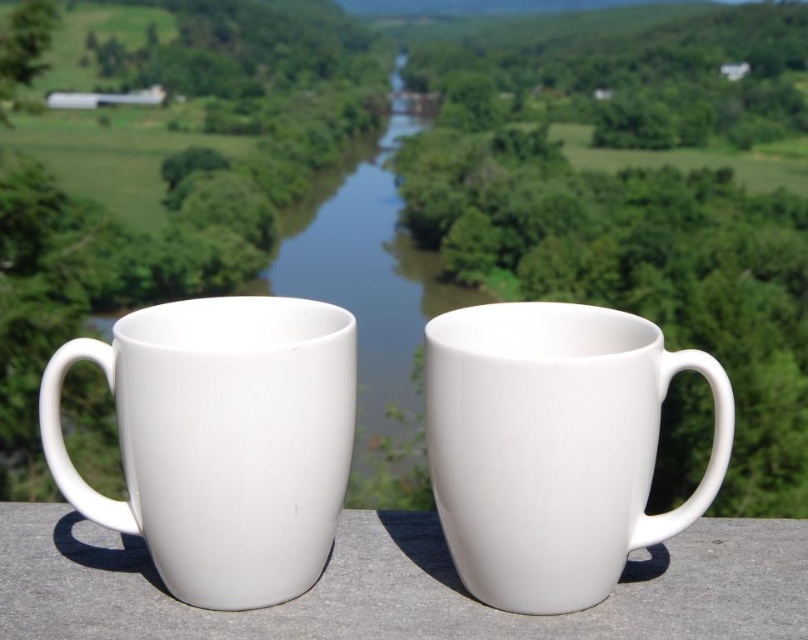
Question: From the image, what is the correct spatial relationship of white matte mug at center in relation to white matte ledge at center?

Choices:
 (A) above
 (B) below

Answer: (A)

Question: Observing the image, what is the correct spatial positioning of white matte mug at center in reference to white matte ledge at center?

Choices:
 (A) left
 (B) right

Answer: (B)

Question: Can you confirm if white glossy mug at left is positioned above white matte ledge at center?

Choices:
 (A) no
 (B) yes

Answer: (B)

Question: Which point appears farthest from the camera in this image?

Choices:
 (A) (127, 426)
 (B) (419, 326)

Answer: (B)

Question: Among these points, which one is nearest to the camera?

Choices:
 (A) (243, 513)
 (B) (432, 260)

Answer: (A)

Question: Among these points, which one is nearest to the camera?

Choices:
 (A) (384, 616)
 (B) (314, 529)
 (C) (419, 253)
 (D) (520, 502)

Answer: (D)